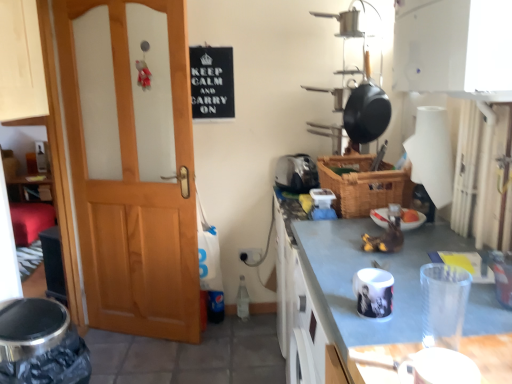
Question: Relative to wooden door at left, is transparent plastic cup at lower right, placed as the 2th appliance when sorted from bottom to top, in front or behind?

Choices:
 (A) front
 (B) behind

Answer: (A)

Question: Considering the positions of transparent plastic cup at lower right, which is counted as the fourth appliance, starting from the back, and wooden door at left in the image, is transparent plastic cup at lower right, which is counted as the fourth appliance, starting from the back, taller or shorter than wooden door at left?

Choices:
 (A) tall
 (B) short

Answer: (B)

Question: Which object is positioned farthest from the white glossy cabinet at upper center?

Choices:
 (A) white glossy plate at center, placed as the third appliance when sorted from bottom to top
 (B) satin silver toaster at center, marked as the 1th appliance in a back-to-front arrangement
 (C) clear plastic bottle at lower center
 (D) black matte sign at upper center
 (E) woven brown basket at center

Answer: (C)

Question: Based on their relative distances, which object is farther from the white glossy mug at center, positioned as the third appliance in back-to-front order?

Choices:
 (A) white glossy cabinet at upper center
 (B) transparent plastic cup at lower right, arranged as the first appliance when viewed from the front
 (C) white glossy plate at center, positioned as the third appliance in front-to-back order
 (D) woven brown basket at center
 (E) wooden door at left

Answer: (E)